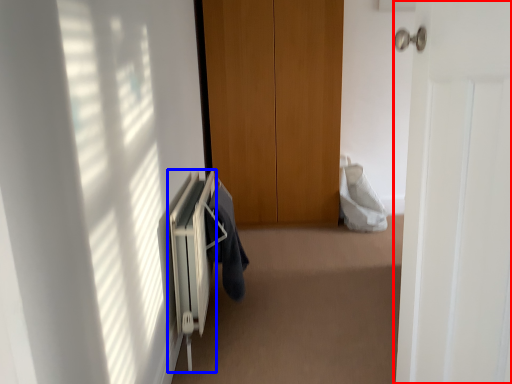
Question: Which object appears farthest to the camera in this image, door (highlighted by a red box) or radiator (highlighted by a blue box)?

Choices:
 (A) door
 (B) radiator

Answer: (B)